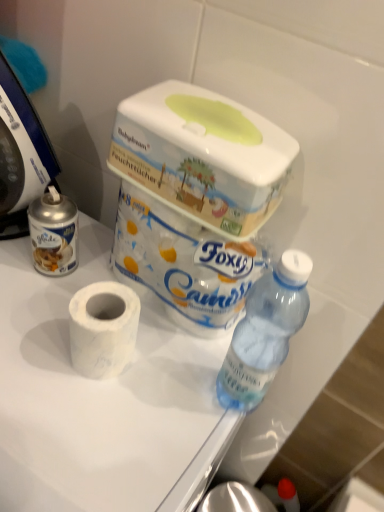
Where is `free space above white plastic box at upper center (from a real-world perspective)`? The image size is (384, 512). free space above white plastic box at upper center (from a real-world perspective) is located at coordinates (206, 112).